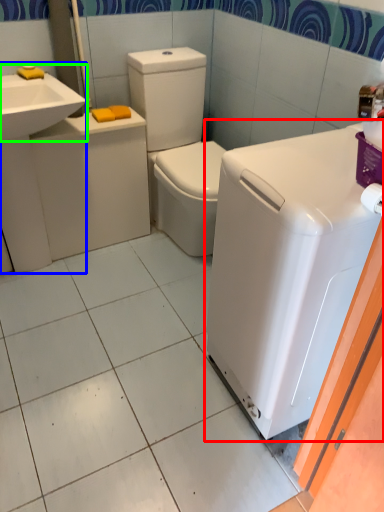
Question: Estimate the real-world distances between objects in this image. Which object is farther from washing machine (highlighted by a red box), sink (highlighted by a blue box) or sink (highlighted by a green box)?

Choices:
 (A) sink
 (B) sink

Answer: (A)